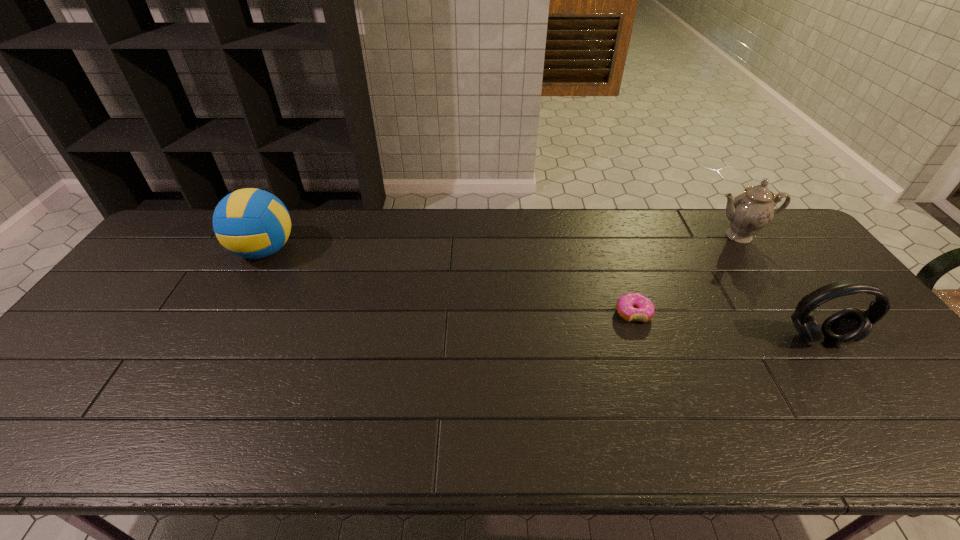
This screenshot has height=540, width=960. I want to click on unoccupied area between the nearest object and the volleyball, so click(x=541, y=295).

Identify the location of vacant area that lies between the second object from left to right and the volleyball. This screenshot has width=960, height=540. (449, 282).

Where is `vacant area that lies between the third object from right to left and the nearest object`? vacant area that lies between the third object from right to left and the nearest object is located at coordinates (726, 326).

In order to click on free point between the leftmost object and the third farthest object in this screenshot , I will do `click(449, 282)`.

The height and width of the screenshot is (540, 960). I want to click on blank region between the shortest object and the volleyball, so click(449, 282).

Locate an element on the screen. vacant area that lies between the doughnut and the chinaware is located at coordinates (x=686, y=274).

Locate an element on the screen. empty location between the nearest object and the shortest object is located at coordinates (726, 326).

This screenshot has width=960, height=540. Find the location of `blank region between the headset and the chinaware`. blank region between the headset and the chinaware is located at coordinates (779, 287).

Locate an element on the screen. vacant space that's between the volleyball and the headset is located at coordinates (541, 295).

You are a GUI agent. You are given a task and a screenshot of the screen. Output one action in this format:
    pyautogui.click(x=<x>, y=<y>)
    Task: Click on the object that stands as the second closest to the chinaware
    This screenshot has width=960, height=540.
    Given the screenshot: What is the action you would take?
    pyautogui.click(x=632, y=306)